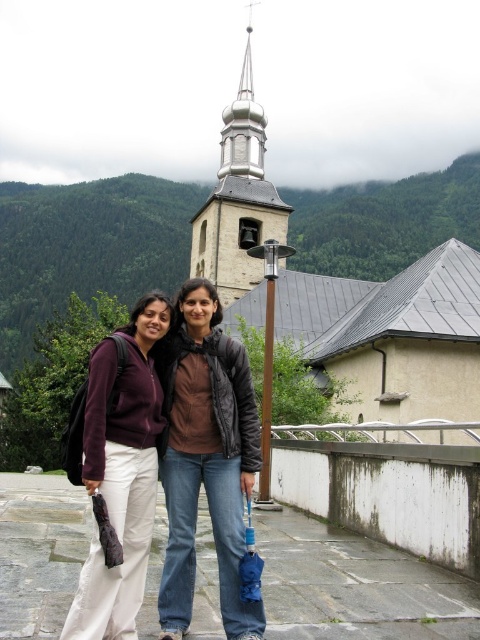
Who is lower down, gold polished spire at upper center or brown matte jacket at center?

brown matte jacket at center is lower down.

Is gold polished spire at upper center positioned behind brown matte jacket at center?

Yes, it is.

At what (x,y) coordinates should I click in order to perform the action: click on gold polished spire at upper center. Please return your answer as a coordinate pair (x, y). Image resolution: width=480 pixels, height=640 pixels. Looking at the image, I should click on (239, 196).

The width and height of the screenshot is (480, 640). I want to click on gold polished spire at upper center, so click(239, 196).

Who is lower down, matte black jacket at center or brown matte jacket at center?

matte black jacket at center

Which is in front, point (168, 369) or point (216, 301)?

Point (168, 369) is in front.

Locate an element on the screen. matte black jacket at center is located at coordinates (205, 461).

Does point (227, 595) come behind point (238, 250)?

No.

Is matte black jacket at center taller than gold polished spire at upper center?

No, matte black jacket at center is not taller than gold polished spire at upper center.

Which is behind, point (240, 376) or point (245, 99)?

The point (245, 99) is more distant.

You are a GUI agent. You are given a task and a screenshot of the screen. Output one action in this format:
    pyautogui.click(x=<x>, y=<y>)
    Task: Click on the matte black jacket at center
    This screenshot has width=480, height=640.
    Given the screenshot: What is the action you would take?
    205,461